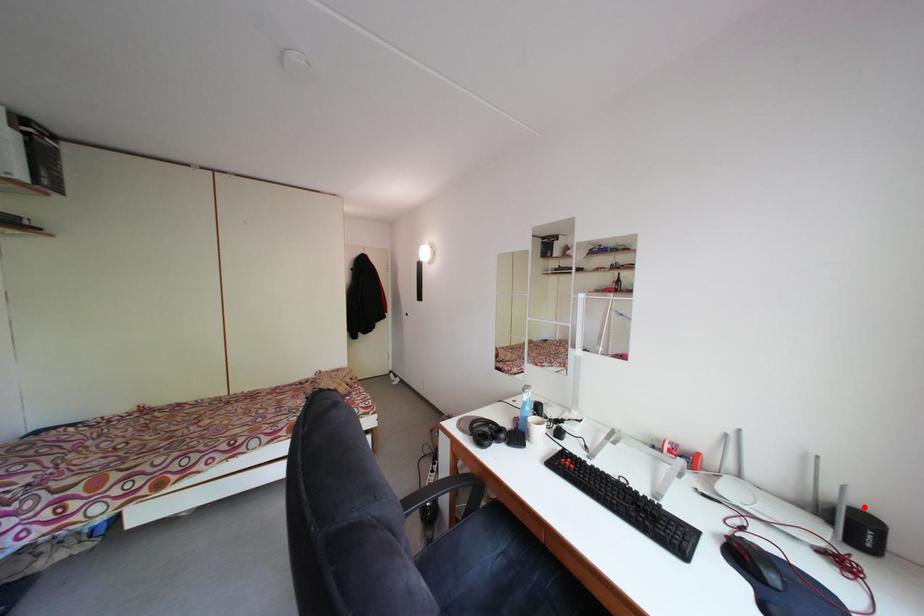
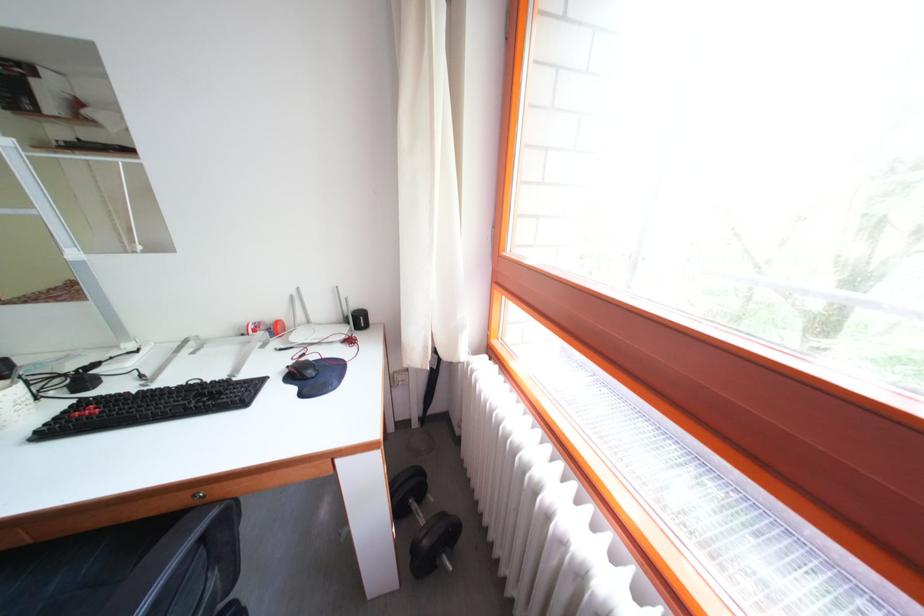
Question: I am providing you with two images of the same scene from different viewpoints. Image1 has a red point marked. In image2, the corresponding 3D location appears at what relative position? Reply with the corresponding letter.

Choices:
 (A) Closer
 (B) Farther

Answer: (A)